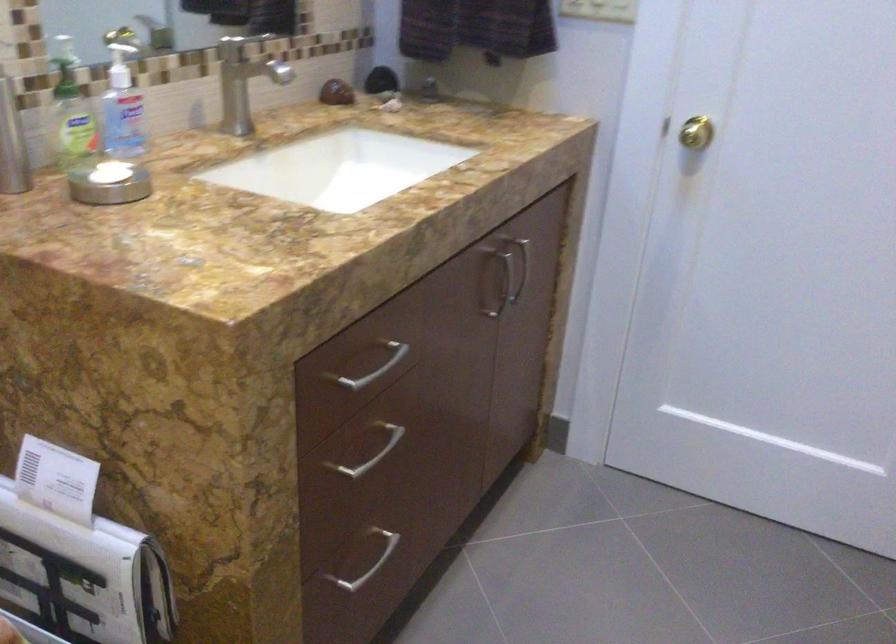
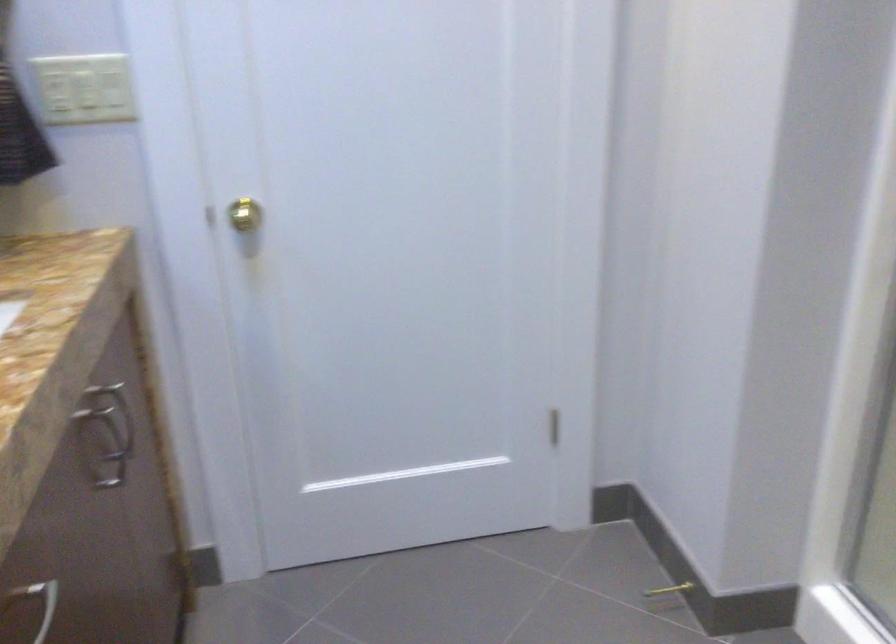
In the second image, find the point that corresponds to [688,129] in the first image.

(240, 214)